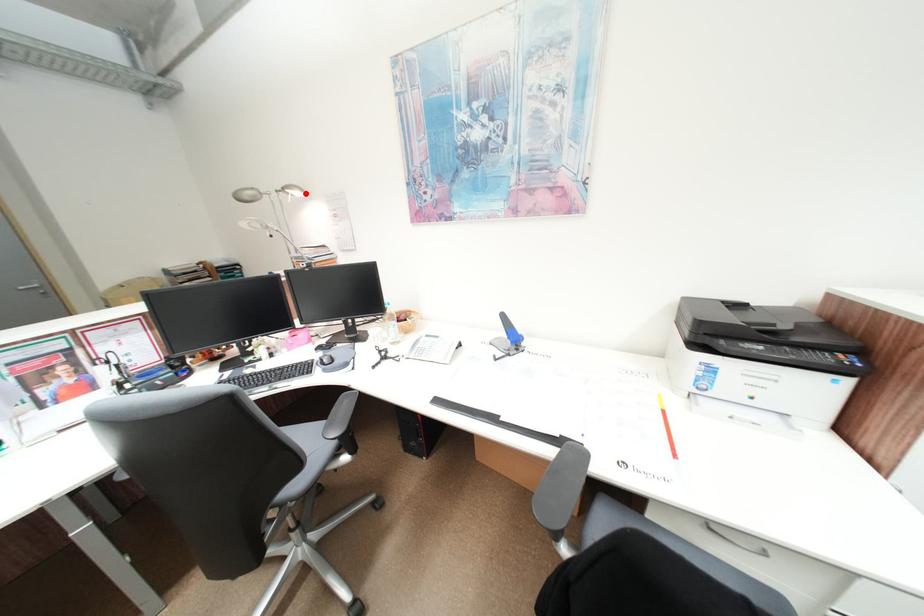
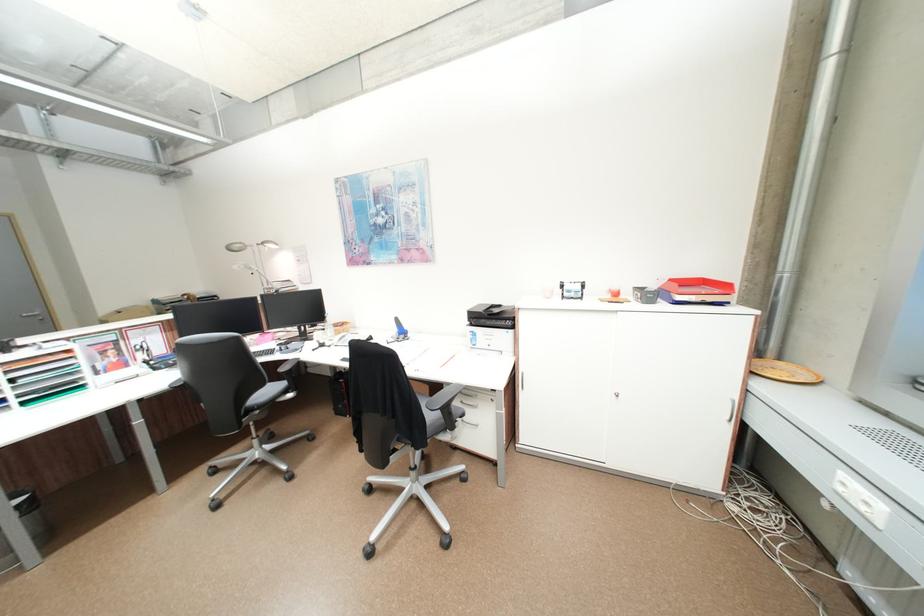
In the second image, find the point that corresponds to the highlighted location in the first image.

(281, 246)